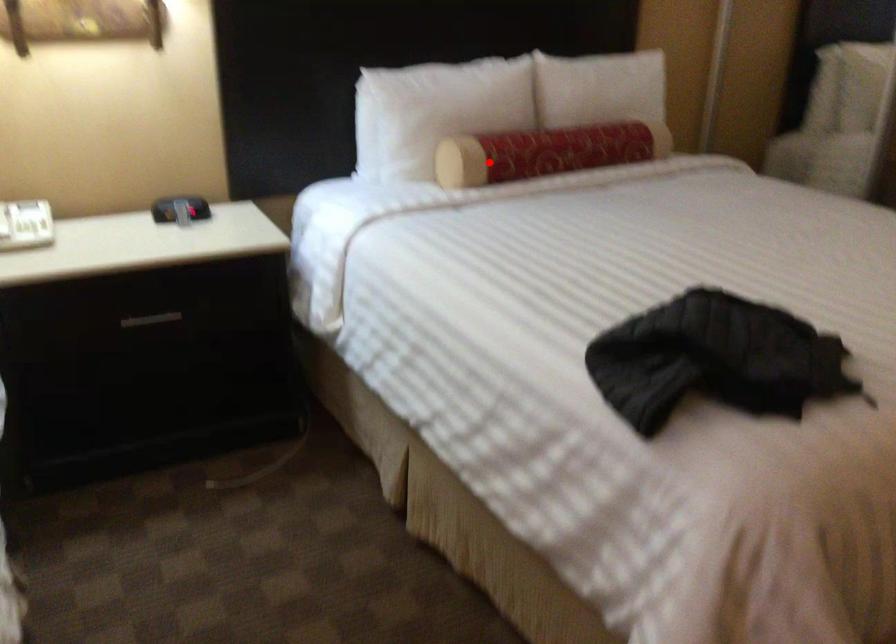
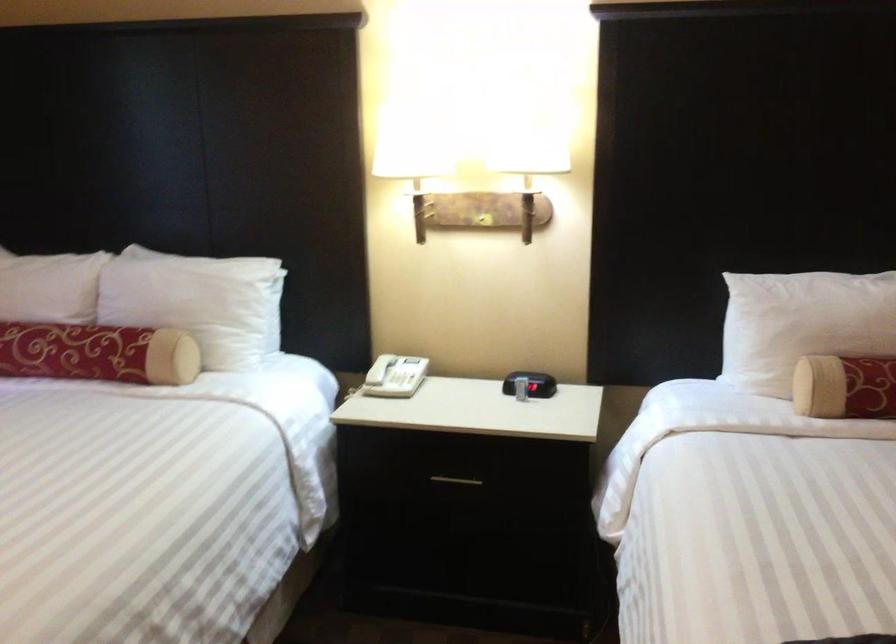
Question: I am providing you with two images of the same scene from different viewpoints. A red point is marked on the first image. Can you still see the location of the red point in image 2?

Choices:
 (A) Yes
 (B) No

Answer: (A)